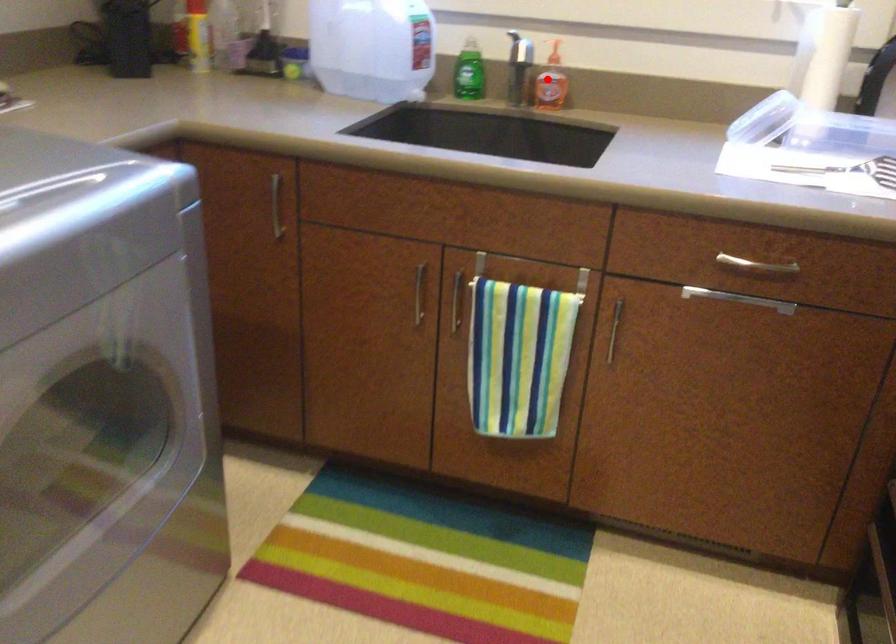
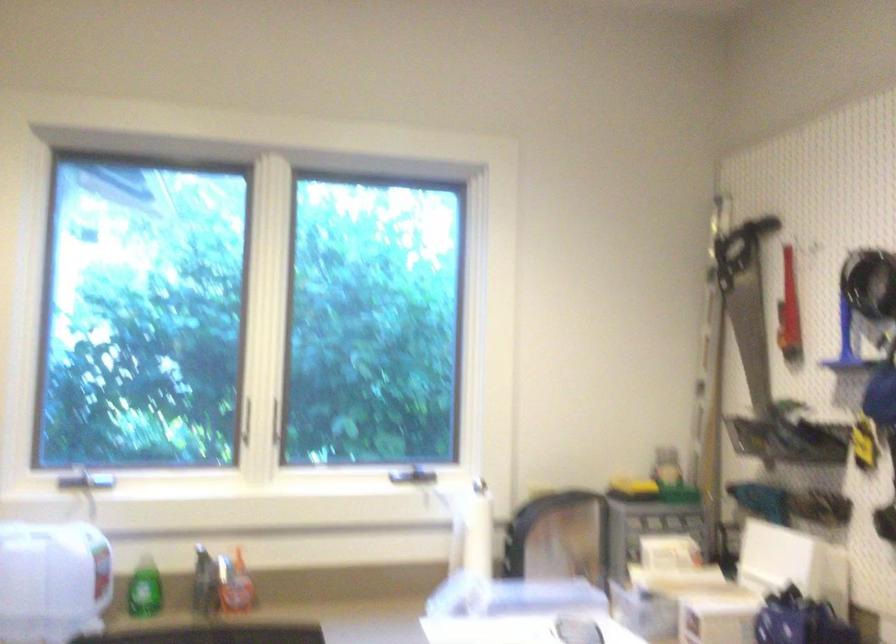
Where in the second image is the point corresponding to the highlighted location from the first image?

(234, 583)